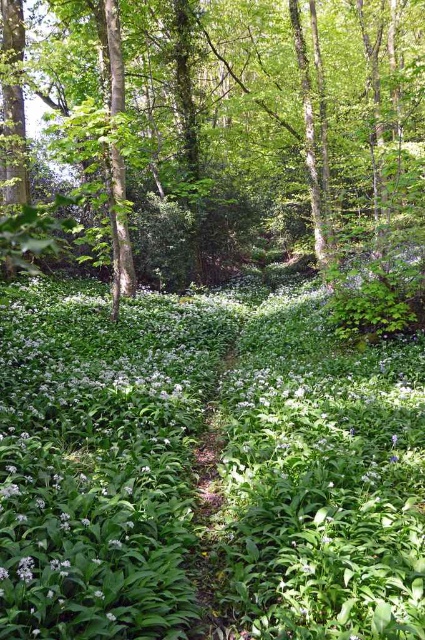
You are a hiker who wants to take a photo of both the white matte flowers at center and the green leafy tree at center in the same frame. Given that your camera has a maximum zoom range of 10 meters, can you capture both subjects without moving your position?

The white matte flowers at center and green leafy tree at center are 8.63 meters apart from each other. Since your camera can zoom up to 10 meters, you can capture both subjects in the same frame without moving your position.

You are a hiker walking along the dirt path in the center of the woodland scene. You notice the white matte flowers at center and the green leafy tree at center. Which of these two objects is positioned to the right of the other?

The white matte flowers at center are to the right of the green leafy tree at center.